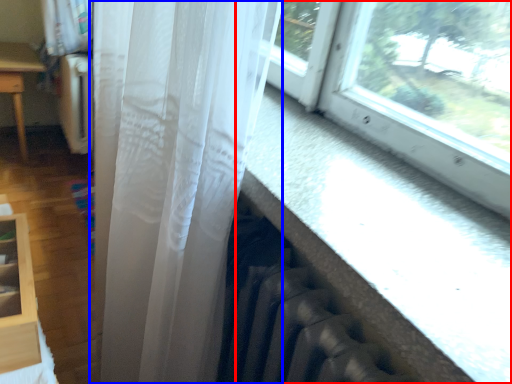
Question: Which object appears closest to the camera in this image, window (highlighted by a red box) or curtain (highlighted by a blue box)?

Choices:
 (A) window
 (B) curtain

Answer: (A)